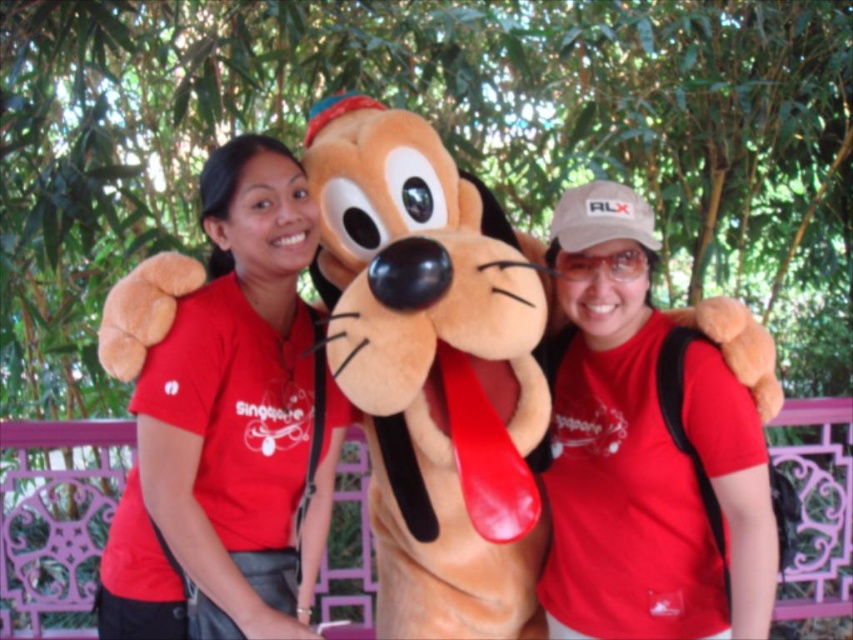
Question: Which point is closer to the camera taking this photo?

Choices:
 (A) coord(552,266)
 (B) coord(224,448)

Answer: (B)

Question: Which of the following is the farthest from the observer?

Choices:
 (A) matte red t-shirt at center
 (B) matte red shirt at center

Answer: (A)

Question: Considering the relative positions of matte red shirt at center and matte red t-shirt at center in the image provided, where is matte red shirt at center located with respect to matte red t-shirt at center?

Choices:
 (A) below
 (B) above

Answer: (B)

Question: Does matte red shirt at center appear under matte red t-shirt at center?

Choices:
 (A) yes
 (B) no

Answer: (B)

Question: Which point appears closest to the camera in this image?

Choices:
 (A) (759, 547)
 (B) (148, 628)

Answer: (A)

Question: Does matte red shirt at center appear over matte red t-shirt at center?

Choices:
 (A) no
 (B) yes

Answer: (B)